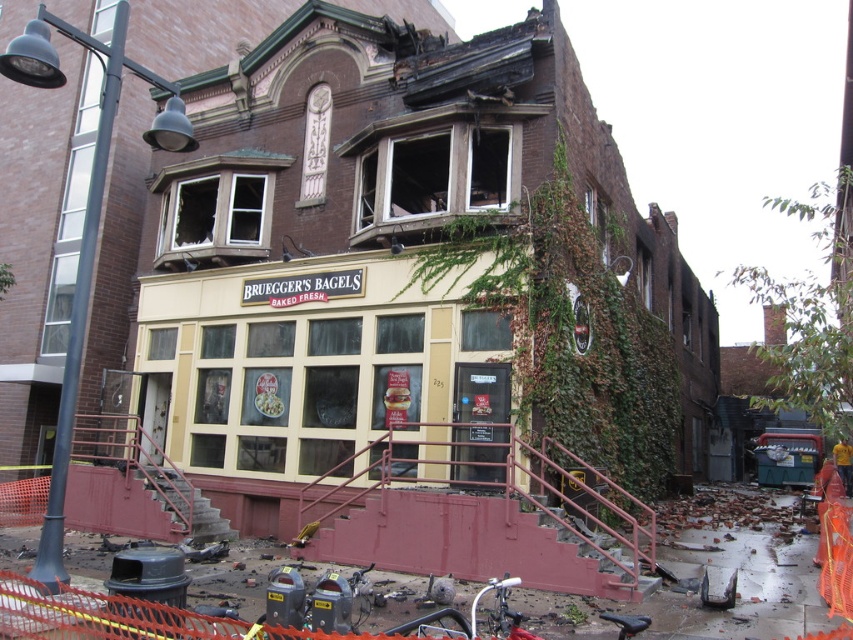
Measure the distance between green ivy at center and camera.

55.25 feet

Which is behind, point (502, 273) or point (821, 209)?

Point (821, 209)

Locate an element on the screen. This screenshot has height=640, width=853. green ivy at center is located at coordinates (569, 333).